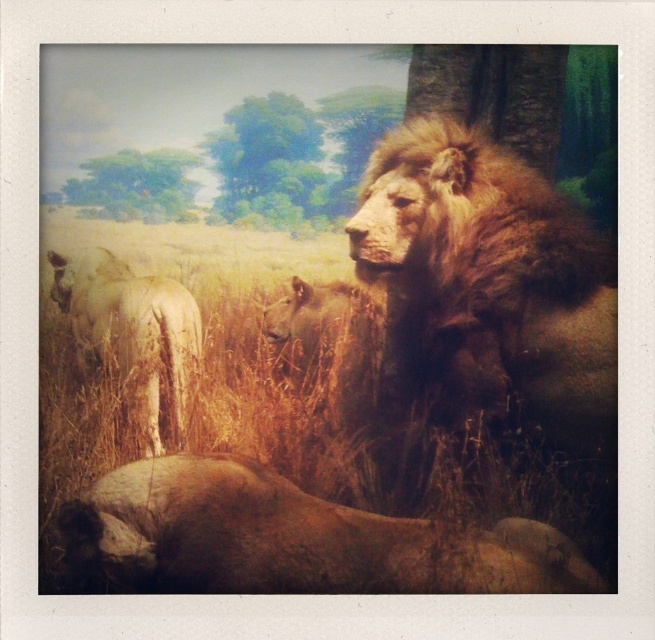
Question: Which of these objects is positioned closest to the brown grass at center?

Choices:
 (A) brown textured lion at left
 (B) brown fur lion at lower center

Answer: (A)

Question: Considering the relative positions of brown fur lion at lower center and brown textured lion at left in the image provided, where is brown fur lion at lower center located with respect to brown textured lion at left?

Choices:
 (A) left
 (B) right

Answer: (B)

Question: Is brown fur lion at lower center closer to camera compared to brown textured lion at left?

Choices:
 (A) no
 (B) yes

Answer: (B)

Question: Which of the following is the farthest from the observer?

Choices:
 (A) (66, 392)
 (B) (563, 420)
 (C) (103, 348)

Answer: (C)

Question: Which point is farther to the camera?

Choices:
 (A) brown fur lion at lower center
 (B) brown grass at center
 (C) brown textured lion at left
 (D) brown furry lion at right

Answer: (C)

Question: Can you confirm if brown furry lion at right is smaller than brown fur lion at lower center?

Choices:
 (A) yes
 (B) no

Answer: (B)